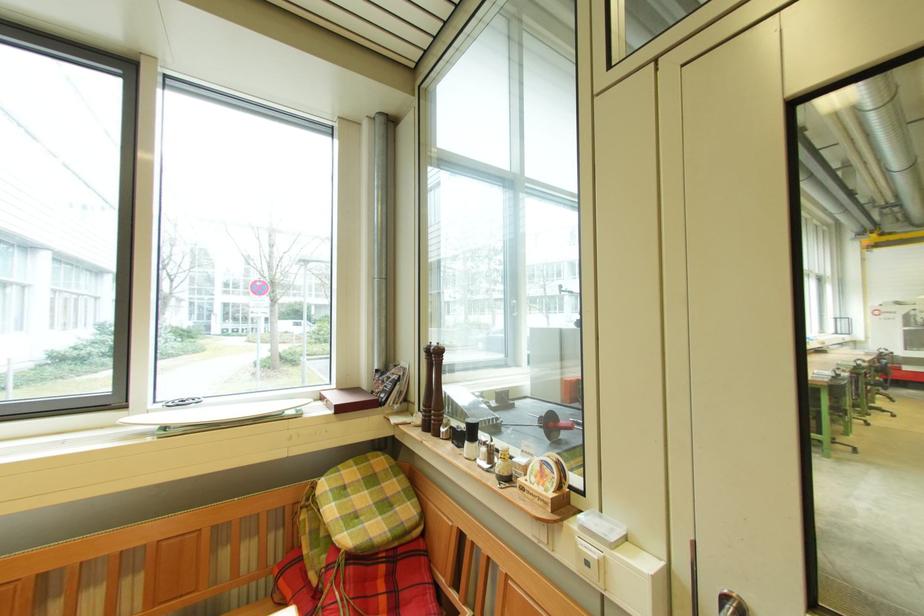
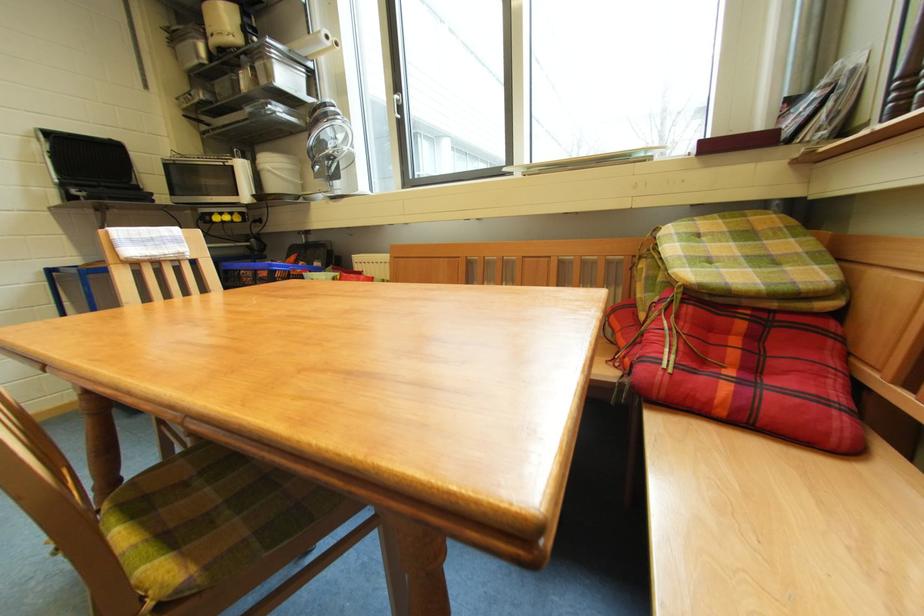
Where in the second image is the point corresponding to pixel 358 464 from the first image?

(723, 219)